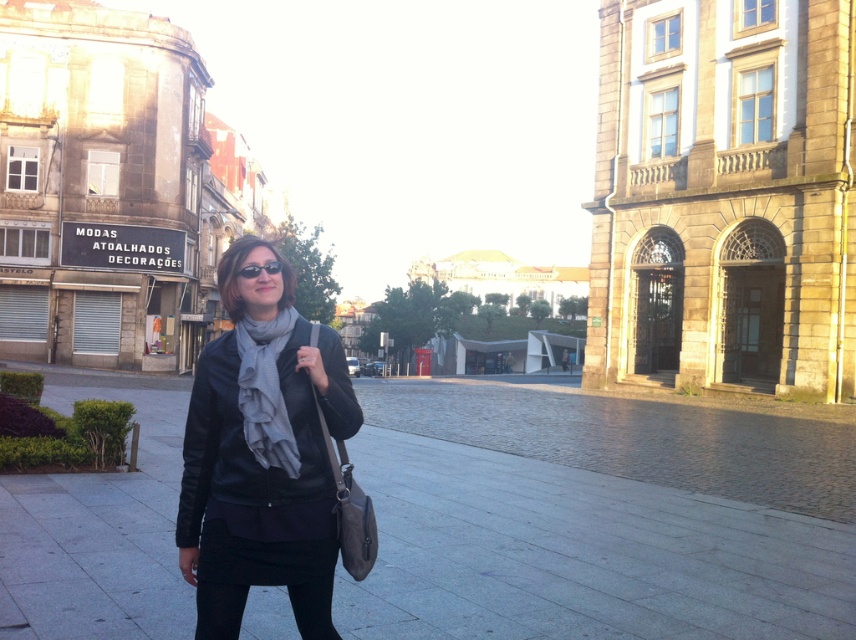
Can you confirm if smooth concrete pavement at center is positioned to the left of black matte sunglasses at center?

Correct, you'll find smooth concrete pavement at center to the left of black matte sunglasses at center.

Measure the distance from smooth concrete pavement at center to black matte sunglasses at center.

12.69 meters

Identify the location of smooth concrete pavement at center. This screenshot has height=640, width=856. (599, 520).

Does smooth concrete pavement at center lie behind matte black jacket at center?

Yes, it is.

Between smooth concrete pavement at center and matte black jacket at center, which one appears on the left side from the viewer's perspective?

smooth concrete pavement at center is more to the left.

Find the location of a particular element. The width and height of the screenshot is (856, 640). smooth concrete pavement at center is located at coordinates (599, 520).

Locate an element on the screen. The width and height of the screenshot is (856, 640). smooth concrete pavement at center is located at coordinates (599, 520).

Is matte black jacket at center behind black leather skirt at lower center?

Yes, it is.

Who is more distant from viewer, (214,483) or (214,611)?

Point (214,483)

Is point (191, 396) farther from viewer compared to point (242, 579)?

Yes, point (191, 396) is farther from viewer.

Image resolution: width=856 pixels, height=640 pixels. Identify the location of matte black jacket at center. (262, 452).